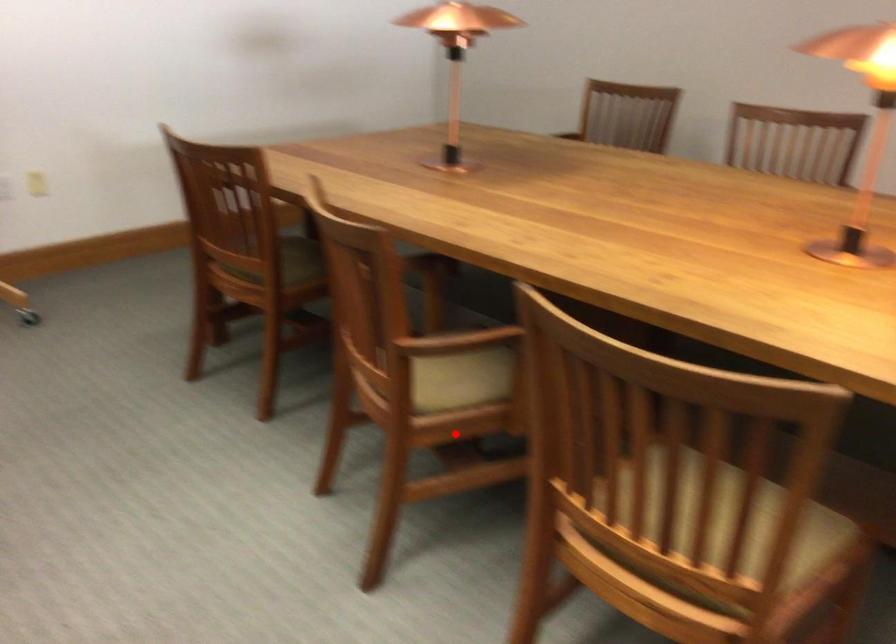
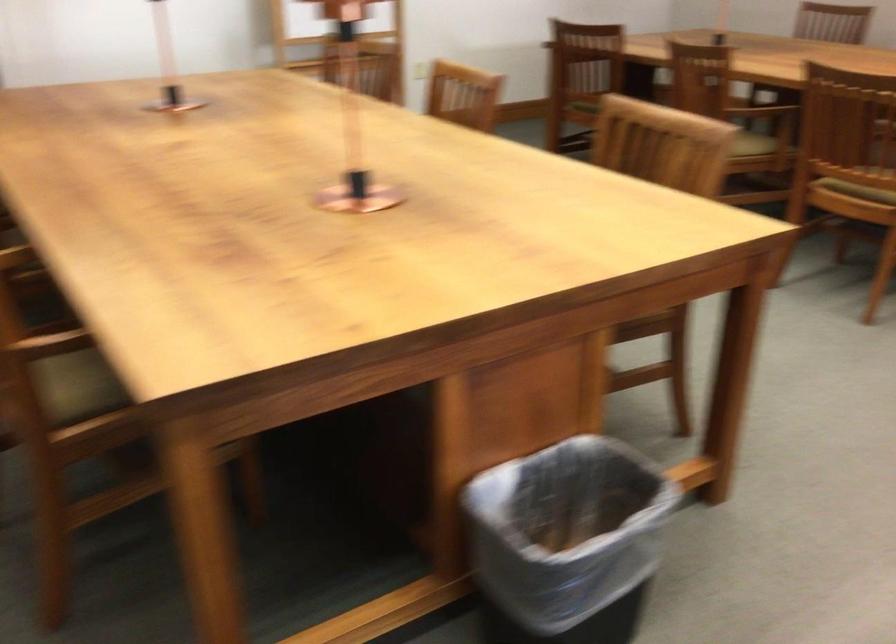
Question: A red point is marked in image1. In image2, is the corresponding 3D point closer to the camera or farther? Reply with the corresponding letter.

Choices:
 (A) The corresponding 3D point is closer.
 (B) The corresponding 3D point is farther.

Answer: (B)